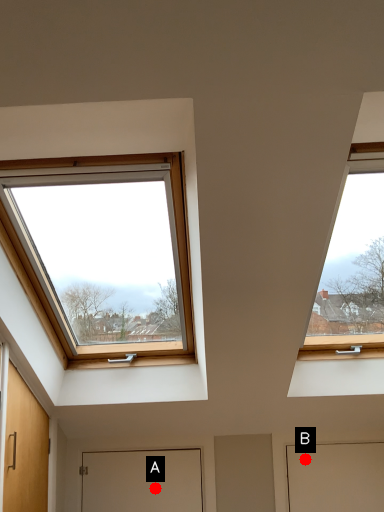
Question: Two points are circled on the image, labeled by A and B beside each circle. Which point is farther from the camera taking this photo?

Choices:
 (A) A is further
 (B) B is further

Answer: (B)